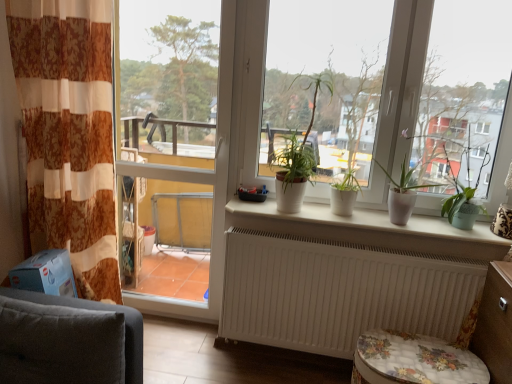
You are a GUI agent. You are given a task and a screenshot of the screen. Output one action in this format:
    pyautogui.click(x=<x>, y=<y>)
    Task: Click on the free space below transparent glass screen door at left (from a real-world perspective)
    The image size is (512, 384).
    Given the screenshot: What is the action you would take?
    pyautogui.click(x=168, y=321)